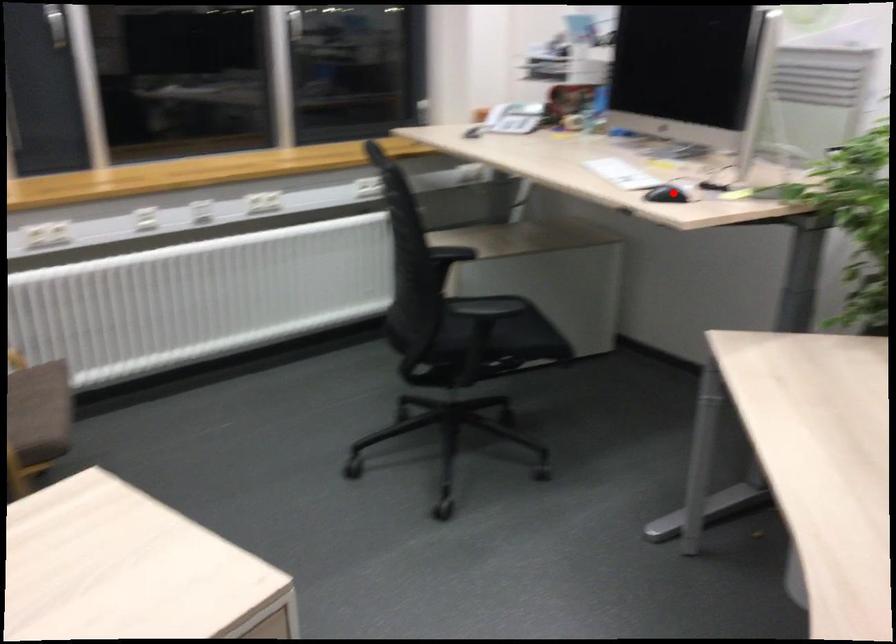
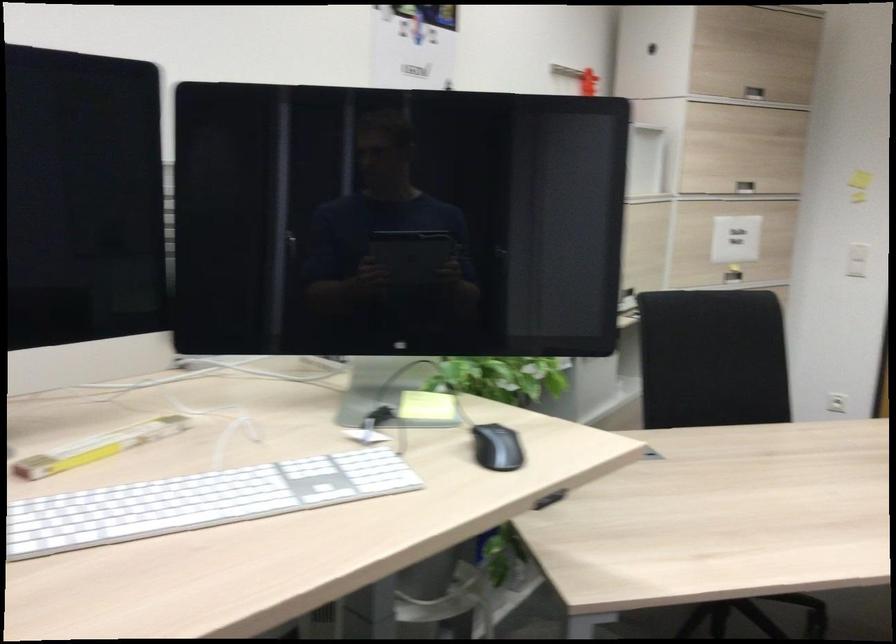
Question: I am providing you with two images of the same scene from different viewpoints. Given a red point in image1, look at the same physical point in image2. Is it:

Choices:
 (A) Closer to the viewpoint
 (B) Farther from the viewpoint

Answer: (A)